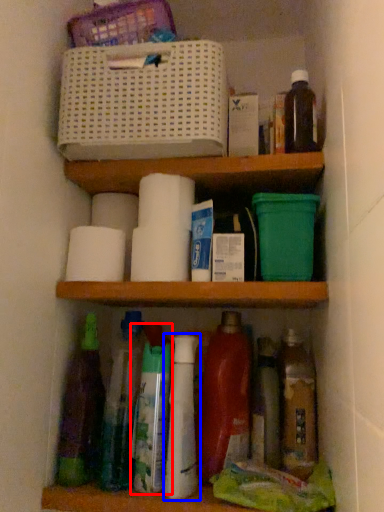
Question: Among these objects, which one is farthest to the camera, bottle (highlighted by a red box) or bottle (highlighted by a blue box)?

Choices:
 (A) bottle
 (B) bottle

Answer: (A)